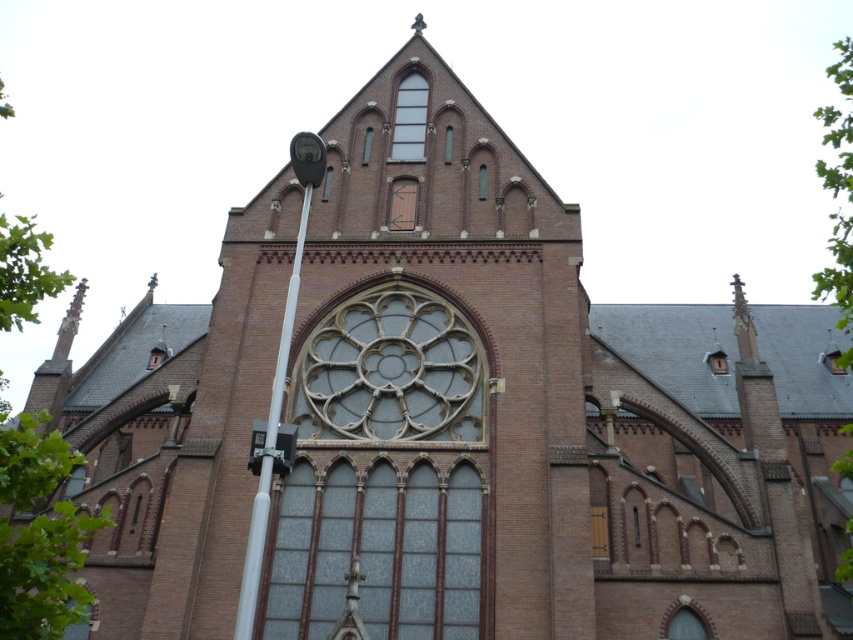
Question: Which point appears farthest from the camera in this image?

Choices:
 (A) (405, 134)
 (B) (364, 568)

Answer: (A)

Question: Does stained glass window at center have a lesser width compared to clear glass door at center?

Choices:
 (A) yes
 (B) no

Answer: (B)

Question: Is clear glass window at upper center in front of clear glass door at center?

Choices:
 (A) no
 (B) yes

Answer: (A)

Question: Is green leafy tree at left behind clear glass window at upper center?

Choices:
 (A) no
 (B) yes

Answer: (A)

Question: Estimate the real-world distances between objects in this image. Which object is farther from the stained glass window at center?

Choices:
 (A) white metallic pole at left
 (B) green leafy tree at upper right
 (C) clear glass window at upper center

Answer: (B)

Question: Which is nearer to the green leafy tree at upper right?

Choices:
 (A) clear glass door at center
 (B) clear glass rose window at center

Answer: (B)